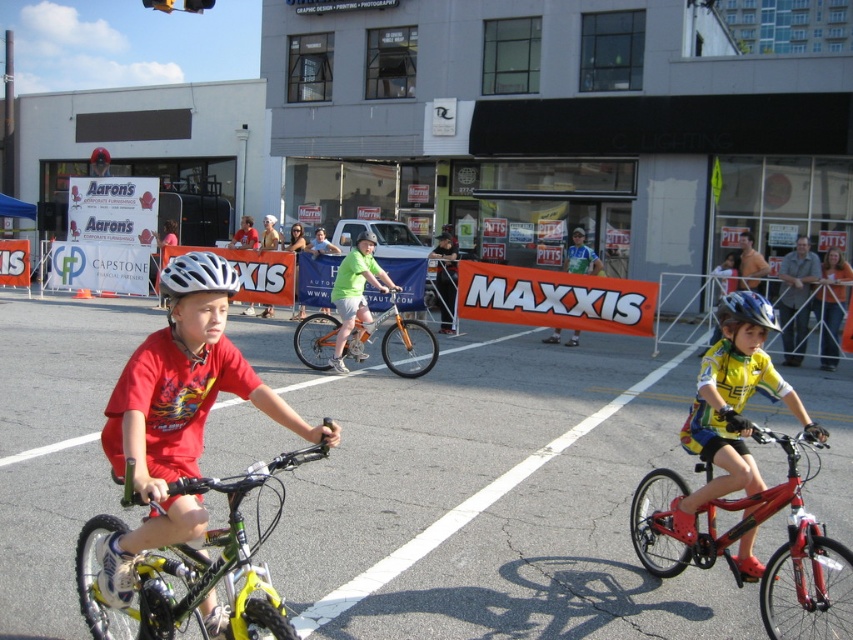
Based on the photo, you are a photographer standing at the starting line of the bicycle race. You want to capture a photo of the yellow jersey cyclist at center. According to the coordinates provided, where should you aim your camera?

The yellow jersey cyclist at center is located at coordinates point [732,404], so you should aim your camera there to capture the cyclist.

Looking at this image, you are a photographer standing at the back of the scene. You want to take a photo of the orange fabric banner at center and the white matte helmet at center. Which object should you adjust your camera to focus on first if you want to capture both in the same frame?

The orange fabric banner at center is positioned on the right side of white matte helmet at center, so you should focus on the white matte helmet at center first to ensure both are in the frame.